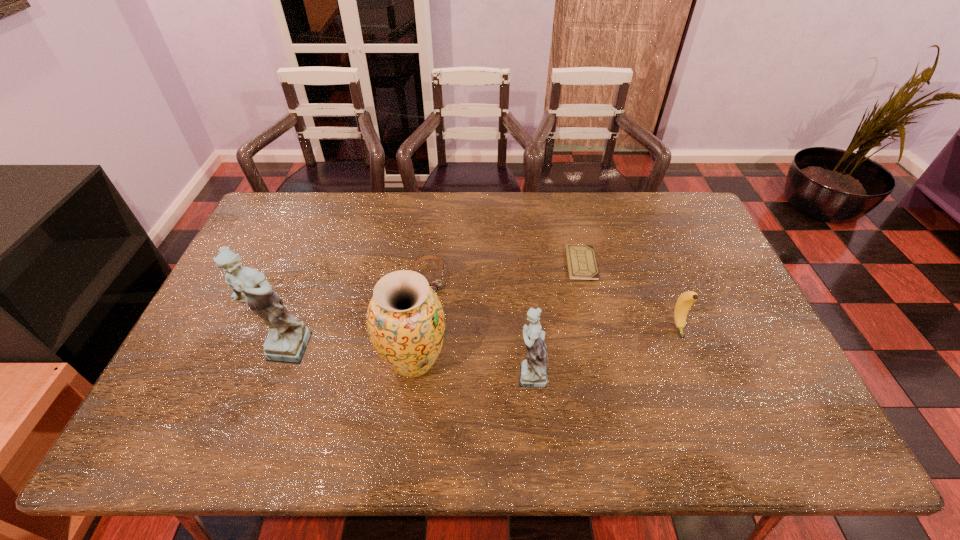
The height and width of the screenshot is (540, 960). Find the location of `the left figurine`. the left figurine is located at coordinates (287, 340).

At what (x,y) coordinates should I click in order to perform the action: click on the tallest object. Please return your answer as a coordinate pair (x, y). The width and height of the screenshot is (960, 540). Looking at the image, I should click on (287, 340).

Locate an element on the screen. This screenshot has height=540, width=960. the third object from right to left is located at coordinates (534, 371).

Locate an element on the screen. the shorter figurine is located at coordinates (534, 371).

Image resolution: width=960 pixels, height=540 pixels. In order to click on checkbook in this screenshot , I will do `click(581, 262)`.

Identify the location of the shortest object. (581, 262).

At what (x,y) coordinates should I click in order to perform the action: click on the fifth tallest object. Please return your answer as a coordinate pair (x, y). The width and height of the screenshot is (960, 540). Looking at the image, I should click on (435, 285).

You are a GUI agent. You are given a task and a screenshot of the screen. Output one action in this format:
    pyautogui.click(x=<x>, y=<y>)
    Task: Click on the rightmost object
    
    Given the screenshot: What is the action you would take?
    pyautogui.click(x=686, y=299)

The height and width of the screenshot is (540, 960). Identify the location of the fourth tallest object. (686, 299).

You are a GUI agent. You are given a task and a screenshot of the screen. Output one action in this format:
    pyautogui.click(x=<x>, y=<y>)
    Task: Click on the vase
    
    Given the screenshot: What is the action you would take?
    pyautogui.click(x=405, y=320)